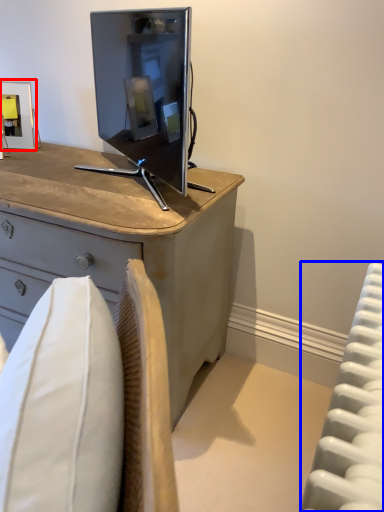
Question: Which point is further to the camera, picture frame (highlighted by a red box) or radiator (highlighted by a blue box)?

Choices:
 (A) picture frame
 (B) radiator

Answer: (A)